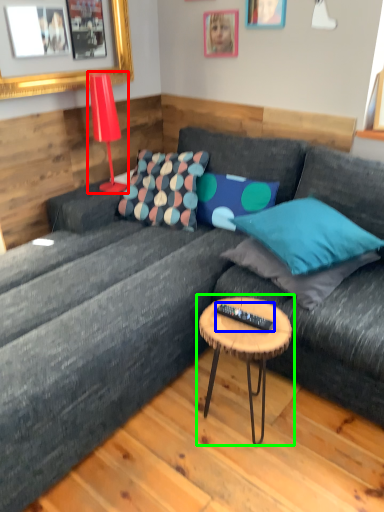
Question: Which object is positioned closest to lamp (highlighted by a red box)? Select from remote (highlighted by a blue box) and coffee table (highlighted by a green box).

Choices:
 (A) remote
 (B) coffee table

Answer: (B)